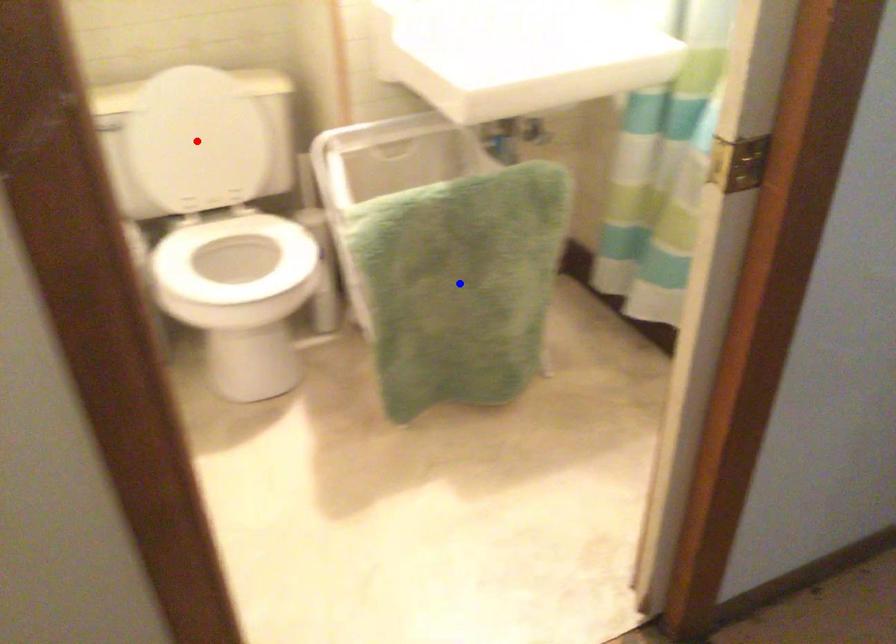
Question: Which of the two points in the image is closer to the camera?

Choices:
 (A) Blue point is closer.
 (B) Red point is closer.

Answer: (A)